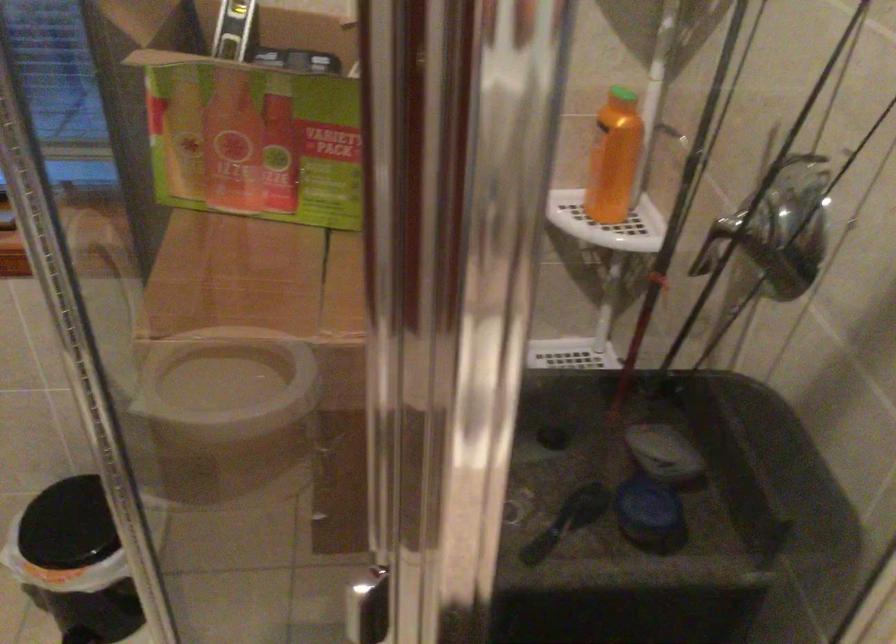
Locate an element on the screen. The height and width of the screenshot is (644, 896). white toilet seat is located at coordinates (244, 383).